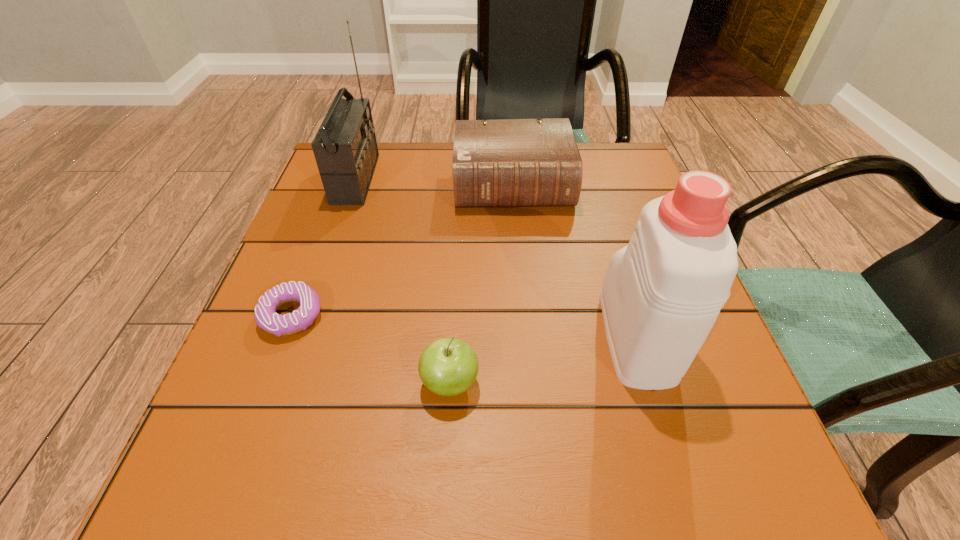
This screenshot has height=540, width=960. I want to click on radio receiver, so click(345, 148).

I want to click on detergent, so click(662, 293).

Where is `Bible`? Image resolution: width=960 pixels, height=540 pixels. Bible is located at coordinates [513, 162].

Where is `the second shortest object`? The image size is (960, 540). the second shortest object is located at coordinates (447, 367).

Identify the location of doughnut. (265, 316).

This screenshot has height=540, width=960. I want to click on free space located on the front panel of the radio receiver, so click(456, 179).

Identify the location of free space located on the handle side of the detergent. This screenshot has width=960, height=540. (601, 218).

I want to click on free space located 0.100m on the handle side of the detergent, so click(611, 251).

Where is `vacant space located 0.060m on the handle side of the detergent`? The image size is (960, 540). vacant space located 0.060m on the handle side of the detergent is located at coordinates (615, 266).

This screenshot has height=540, width=960. I want to click on vacant space located 0.130m on the spine side of the Bible, so click(519, 256).